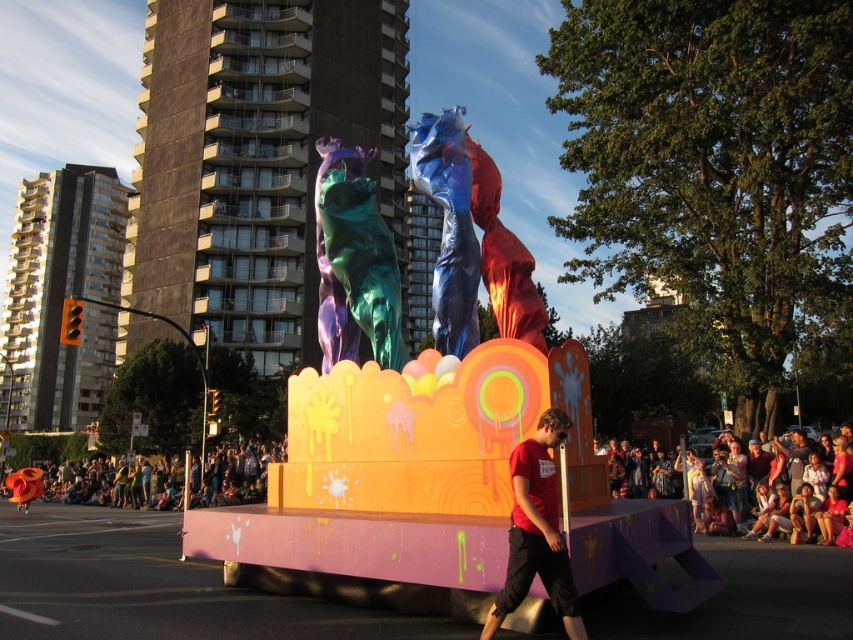
Does point (509, 513) lie behind point (225, 480)?

No, it is in front of (225, 480).

What do you see at coordinates (537, 531) in the screenshot?
I see `red matte t-shirt at center` at bounding box center [537, 531].

Is point (479, 636) behind point (219, 468)?

No.

Identify the location of red matte t-shirt at center. (537, 531).

The height and width of the screenshot is (640, 853). What are the coordinates of `multicolored fabric crowd at lower center` in the screenshot? It's located at (241, 472).

Can you confirm if multicolored fabric crowd at lower center is taller than matte pink fabric at lower right?

Correct, multicolored fabric crowd at lower center is much taller as matte pink fabric at lower right.

What do you see at coordinates (241, 472) in the screenshot? This screenshot has height=640, width=853. I see `multicolored fabric crowd at lower center` at bounding box center [241, 472].

Find the location of a particular element. multicolored fabric crowd at lower center is located at coordinates (241, 472).

Can you confirm if metallic teal bear at center is positioned above multicolored fabric crowd at lower center?

Yes.

Consider the image. Who is more forward, [329,337] or [244,474]?

Point [329,337]

The width and height of the screenshot is (853, 640). I want to click on metallic teal bear at center, so click(x=354, y=260).